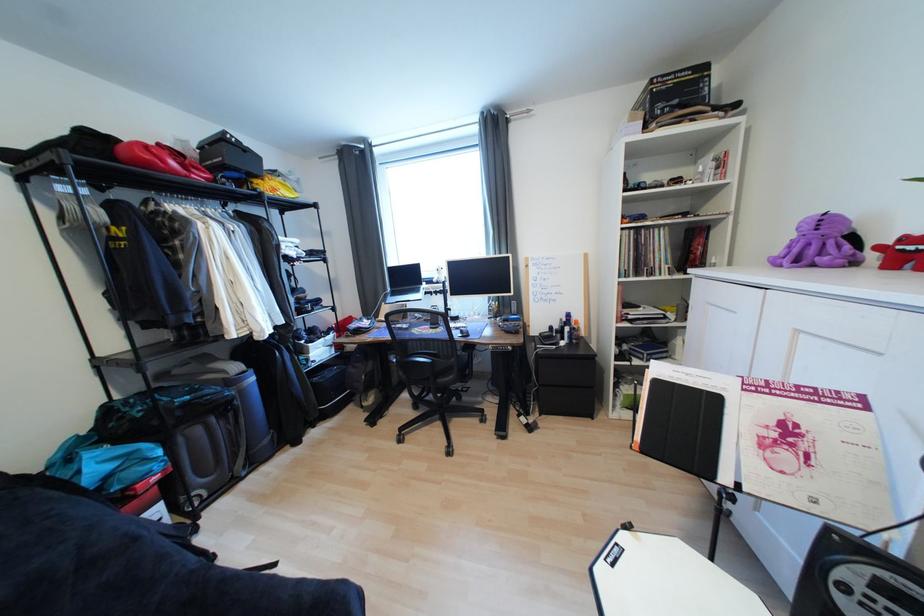
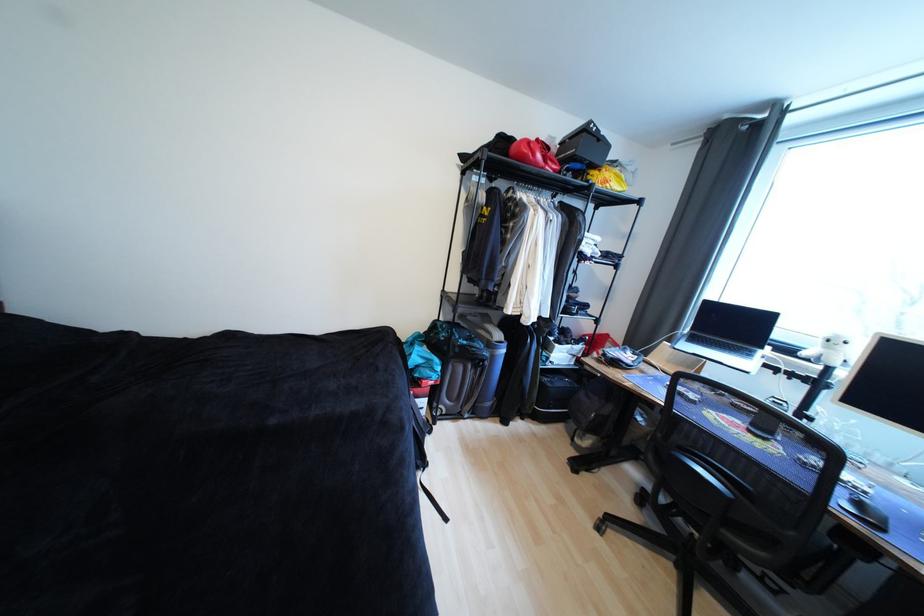
In the second image, find the point that corresponds to the point at 192,406 in the first image.

(469, 347)